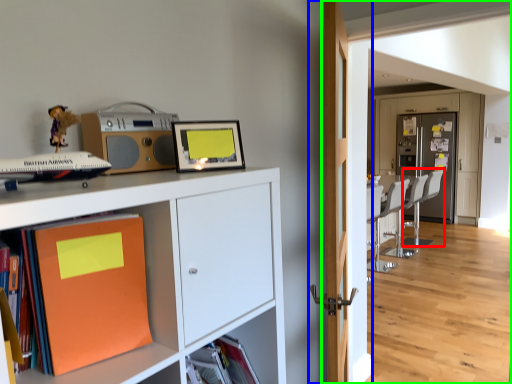
Question: Estimate the real-world distances between objects in this image. Which object is farther from swivel chair (highlighted by a red box), door (highlighted by a blue box) or corridor (highlighted by a green box)?

Choices:
 (A) door
 (B) corridor

Answer: (A)